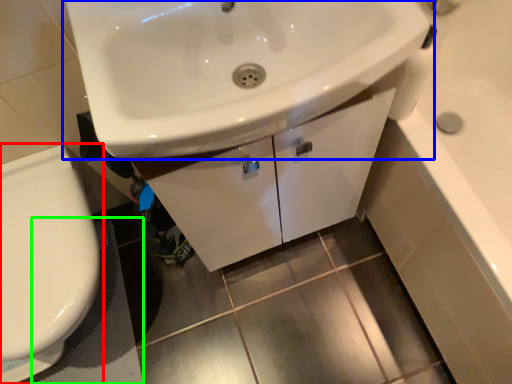
Question: Which object is positioned farthest from toilet (highlighted by a red box)? Select from sink (highlighted by a blue box) and bath mat (highlighted by a green box).

Choices:
 (A) sink
 (B) bath mat

Answer: (A)